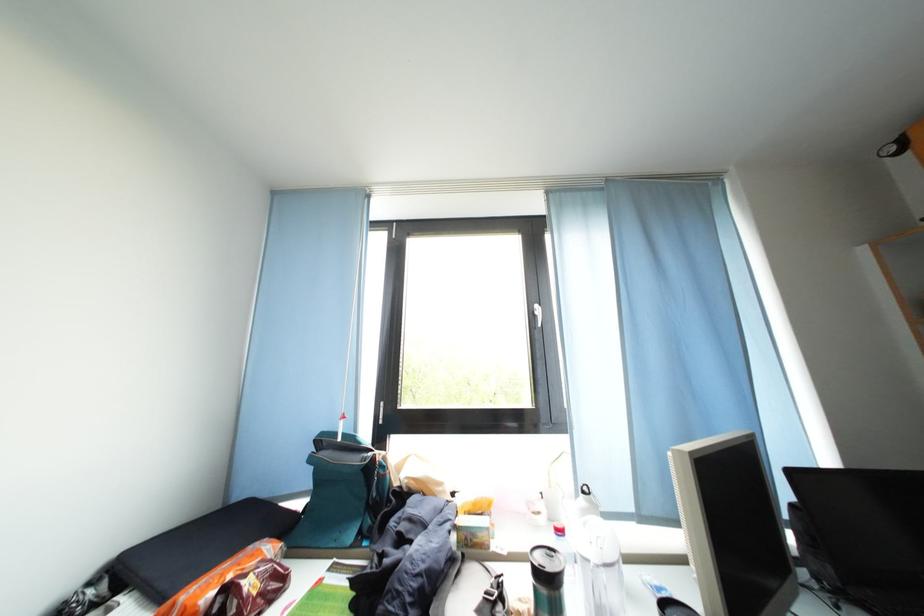
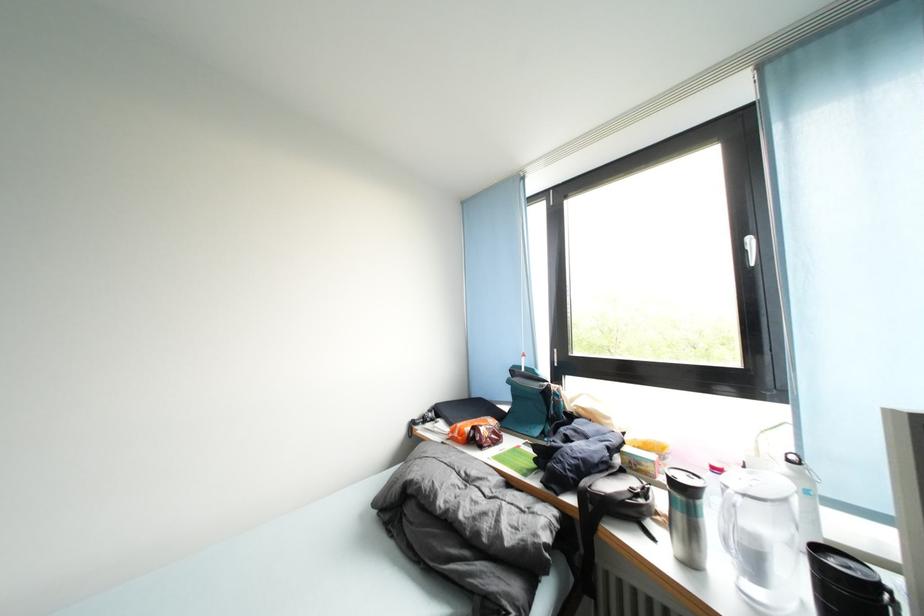
In the second image, find the point that corresponds to point 544,318 in the first image.

(757, 253)